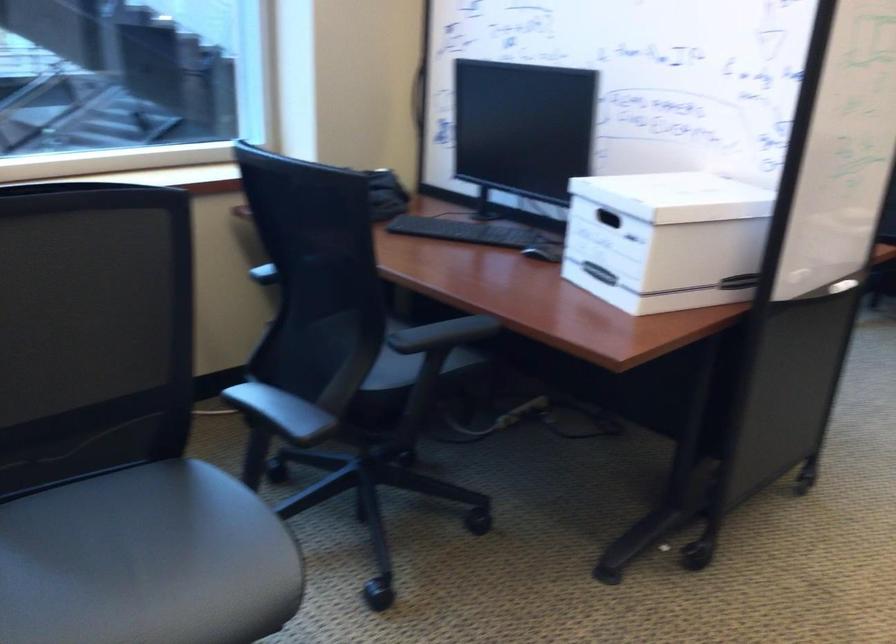
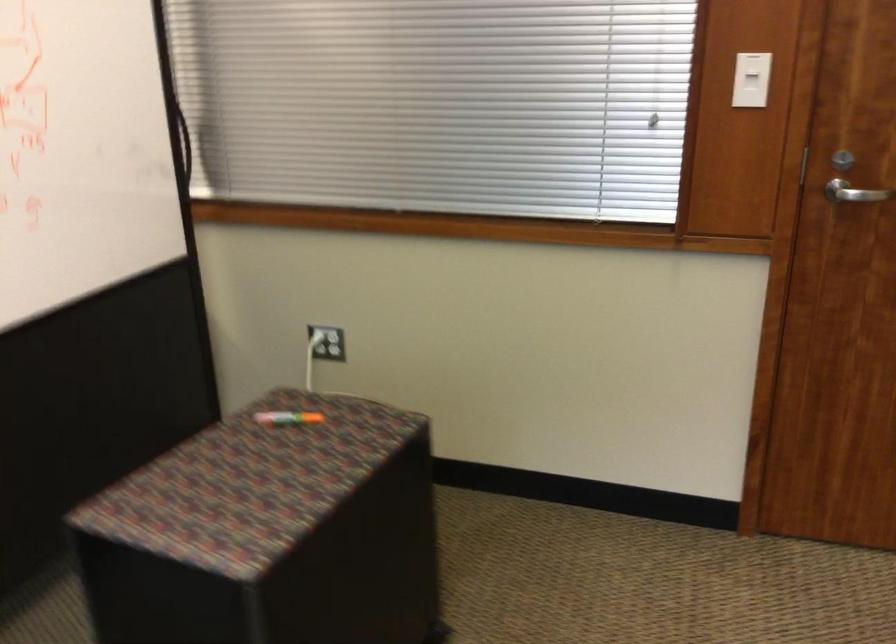
The images are taken continuously from a first-person perspective. In which direction is your viewpoint rotating?

The camera rotated toward right-down.